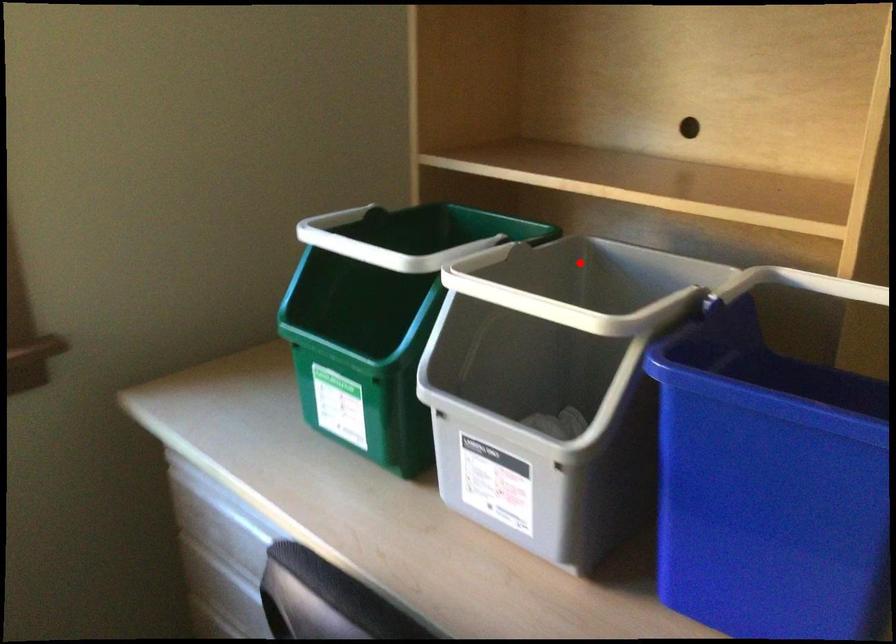
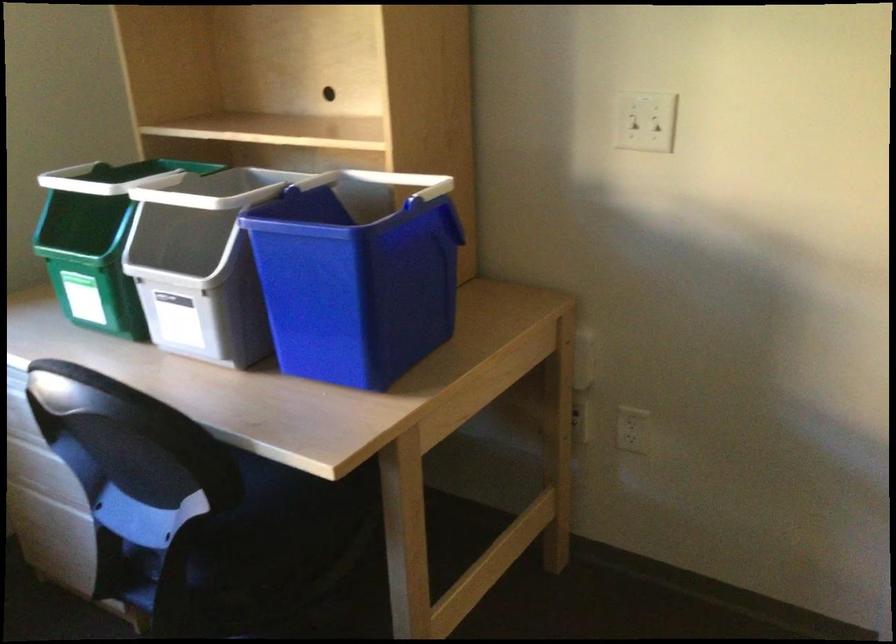
In the second image, find the point that corresponds to the highlighted location in the first image.

(245, 185)